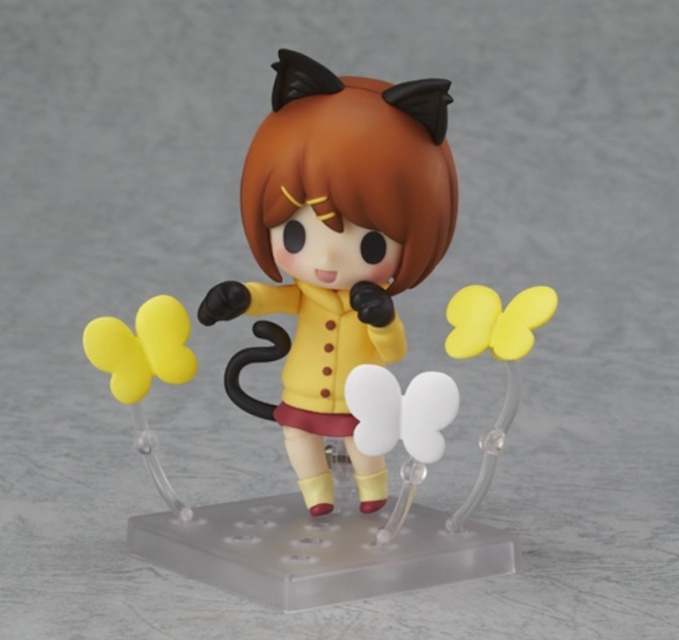
Which of these two, yellow matte figure at center or yellow matte balloon at left, stands shorter?

Standing shorter between the two is yellow matte balloon at left.

Is yellow matte figure at center further to camera compared to yellow matte balloon at left?

No, yellow matte figure at center is in front of yellow matte balloon at left.

Is point (340, 426) more distant than point (147, 349)?

Yes.

Where is `yellow matte figure at center`? yellow matte figure at center is located at coordinates (331, 348).

Is point (411, 125) positioned in front of point (175, 349)?

Yes, point (411, 125) is in front of point (175, 349).

Where is `matte yellow figure at center`? The height and width of the screenshot is (640, 679). matte yellow figure at center is located at coordinates (335, 248).

Does yellow matte figure at center appear on the left side of matte yellow figure at center?

Incorrect, yellow matte figure at center is not on the left side of matte yellow figure at center.

Does yellow matte figure at center have a smaller size compared to matte yellow figure at center?

No, yellow matte figure at center is not smaller than matte yellow figure at center.

Who is more forward, (416, 92) or (230, 392)?

Point (416, 92) is in front.

This screenshot has height=640, width=679. Identify the location of yellow matte figure at center. (331, 348).